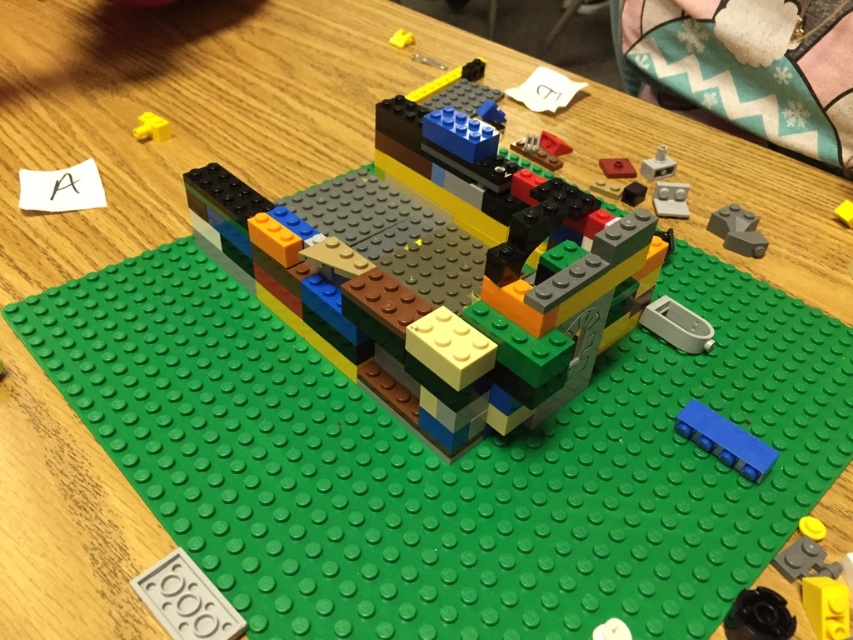
You are an engineer inspecting a LEGO model on a table. You notice the clear plastic lever at upper right and the yellow plastic piece at upper center. Which of these two components is taller?

The clear plastic lever at upper right is taller than the yellow plastic piece at upper center according to the description.

You are a LEGO designer working on a new project. You need to place a new red brick exactly at the center of the green baseplate. The green baseplate is on a wooden table. Where should you place the new red brick relative to the matte yellow brick at upper left?

The matte yellow brick at upper left is located at point (151, 128). To place the new red brick at the center of the green baseplate, you should position it at the coordinates corresponding to the center point of the baseplate, which would be different from the matte yellow brick at upper left.

You are an architect examining the LEGO model on the table. You notice the matte gray bricks at upper right and the yellow plastic piece at upper center. Which object is located below the other?

The matte gray bricks at upper right are positioned under the yellow plastic piece at upper center.